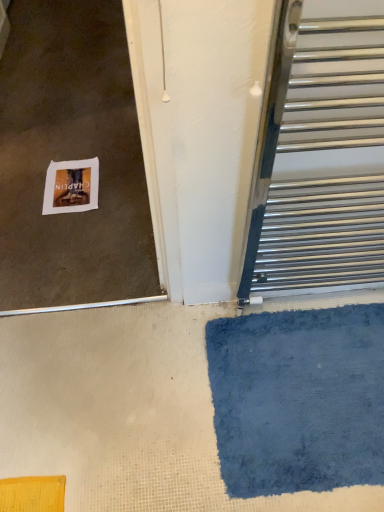
Question: Relative to polished metal towel rack at right, is blue plush bath mat at lower right in front or behind?

Choices:
 (A) behind
 (B) front

Answer: (A)

Question: In terms of width, does blue plush bath mat at lower right look wider or thinner when compared to polished metal towel rack at right?

Choices:
 (A) wide
 (B) thin

Answer: (A)

Question: Which of these objects is positioned farthest from the blue plush bath mat at lower right?

Choices:
 (A) polished metal towel rack at right
 (B) white paper at lower left

Answer: (B)

Question: Considering the real-world distances, which object is farthest from the blue plush bath mat at lower right?

Choices:
 (A) white paper at lower left
 (B) polished metal towel rack at right

Answer: (A)